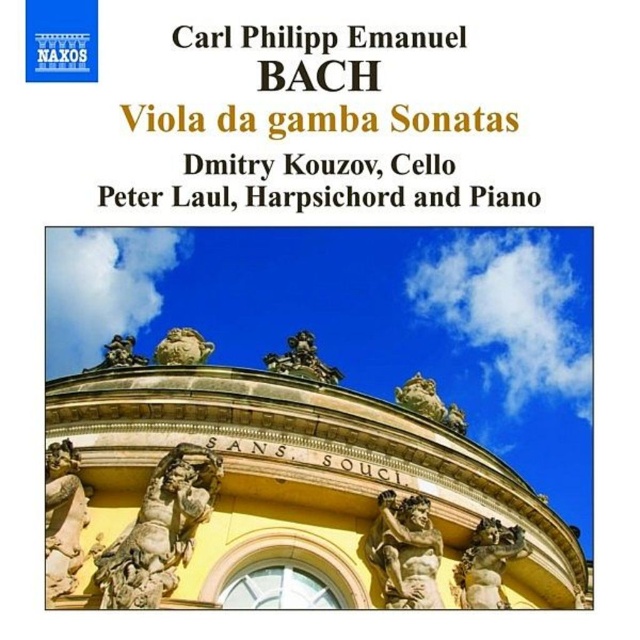
Who is shorter, polished bronze statue at center or polished stone lion at center?

polished bronze statue at center

Locate an element on the screen. Image resolution: width=640 pixels, height=640 pixels. polished bronze statue at center is located at coordinates (301, 360).

Is point (429, 548) less distant than point (490, 525)?

Yes, point (429, 548) is closer to viewer.

Can you confirm if bronze statue at center is positioned above golden stone statue at center?

Yes.

Is point (381, 595) less distant than point (486, 576)?

Yes.

Where is `bronze statue at center`? bronze statue at center is located at coordinates (404, 552).

Can you confirm if polished stone statue at lower left is positioned to the left of polished stone lion at center?

Correct, you'll find polished stone statue at lower left to the left of polished stone lion at center.

Does polished stone statue at lower left lie in front of polished stone lion at center?

Yes, polished stone statue at lower left is in front of polished stone lion at center.

Find the location of `polished stone statue at lower left`. polished stone statue at lower left is located at coordinates (61, 516).